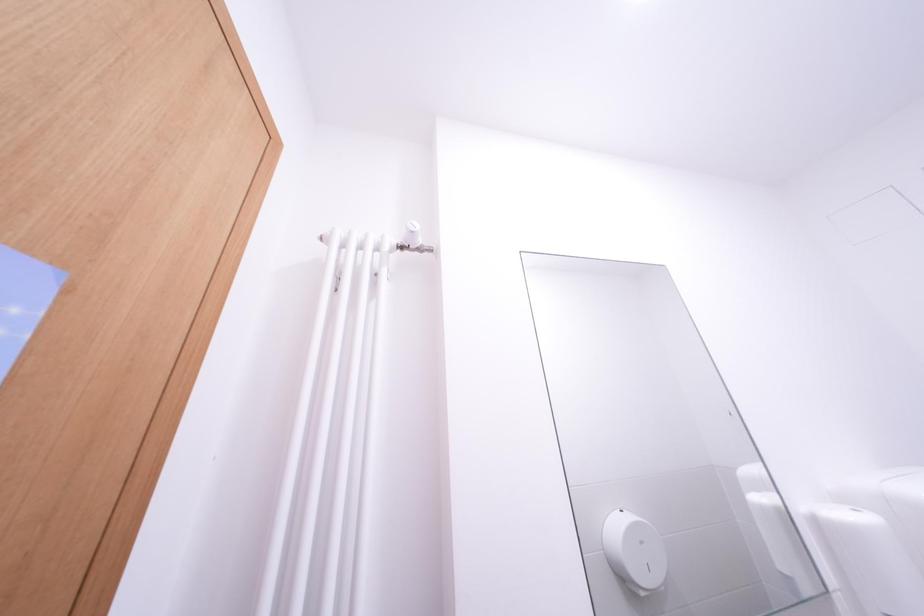
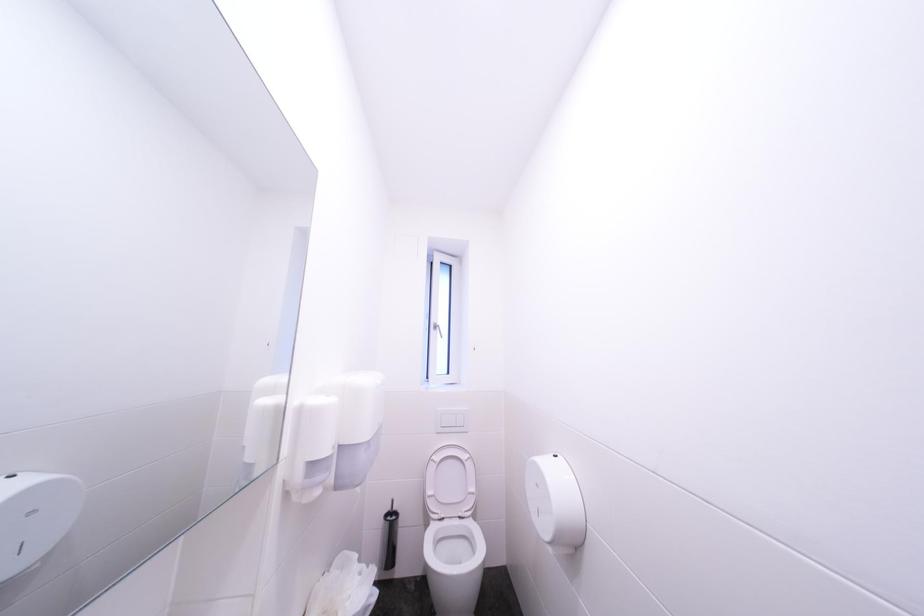
Question: The camera is either moving clockwise (left) or counter-clockwise (right) around the object. The first image is from the beginning of the video and the second image is from the end. Is the camera moving left or right when shooting the video?

Choices:
 (A) Left
 (B) Right

Answer: (A)